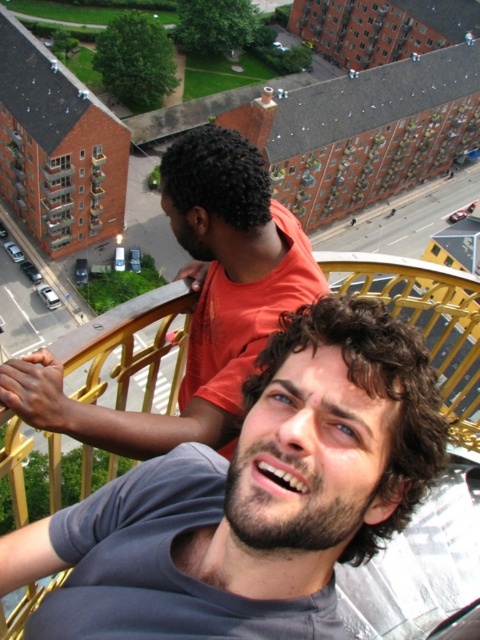
You are a photographer trying to capture both the gray cotton shirt at center and the gray fabric shirt at center in the same frame. Based on their sizes, which one should you focus on first to ensure both are clearly visible in the photo?

The gray cotton shirt at center has a smaller size compared to gray fabric shirt at center. To ensure both are clearly visible, focus on the smaller gray cotton shirt at center first, then adjust the camera to include the larger gray fabric shirt at center in the frame.

You are a photographer trying to capture both the gray cotton shirt at center and the gray fabric shirt at center in a single shot. Which one should you focus on first to ensure both are in frame?

The gray cotton shirt at center is located below the gray fabric shirt at center, so you should focus on the gray fabric shirt at center first to ensure both are in frame.

You are on a balcony with two people in gray shirts. The gray cotton shirt at center and the gray fabric shirt at center are both facing the same direction. Which one would you see first if you were looking from the city below?

The gray cotton shirt at center is in front of the gray fabric shirt at center, so you would see the gray cotton shirt at center first from below.